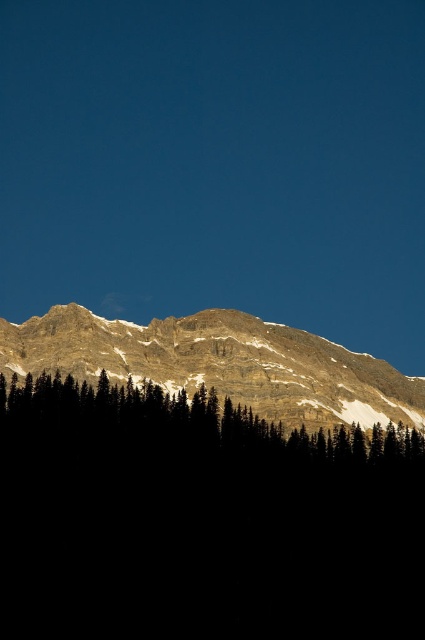
Question: Which object appears farthest from the camera in this image?

Choices:
 (A) green textured trees at center
 (B) rocky brown mountain range at upper center

Answer: (B)

Question: Observing the image, what is the correct spatial positioning of green textured trees at lower center in reference to rocky brown mountain range at upper center?

Choices:
 (A) left
 (B) right

Answer: (A)

Question: Does rocky brown mountain range at upper center have a greater width compared to green textured trees at center?

Choices:
 (A) yes
 (B) no

Answer: (A)

Question: Among these points, which one is nearest to the camera?

Choices:
 (A) (19, 579)
 (B) (422, 396)

Answer: (A)

Question: Which point appears farthest from the camera in this image?

Choices:
 (A) (329, 371)
 (B) (172, 445)
 (C) (246, 593)

Answer: (A)

Question: Can you confirm if rocky brown mountain range at upper center is smaller than green textured trees at center?

Choices:
 (A) yes
 (B) no

Answer: (B)